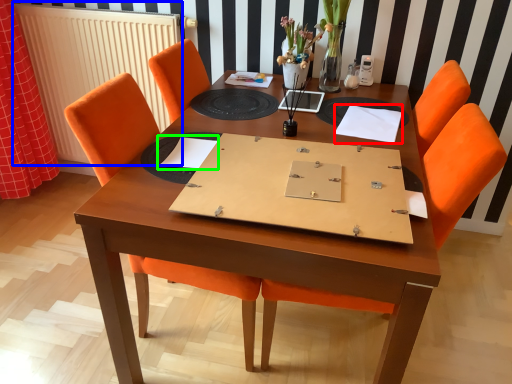
Question: Considering the real-world distances, which object is closest to notebook (highlighted by a red box)? radiator (highlighted by a blue box) or notebook (highlighted by a green box).

Choices:
 (A) radiator
 (B) notebook

Answer: (B)